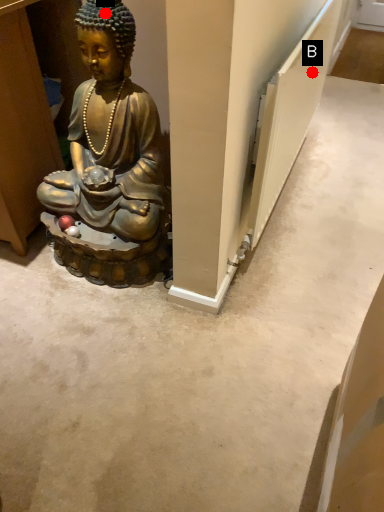
Question: Two points are circled on the image, labeled by A and B beside each circle. Among these points, which one is nearest to the camera?

Choices:
 (A) A is closer
 (B) B is closer

Answer: (A)